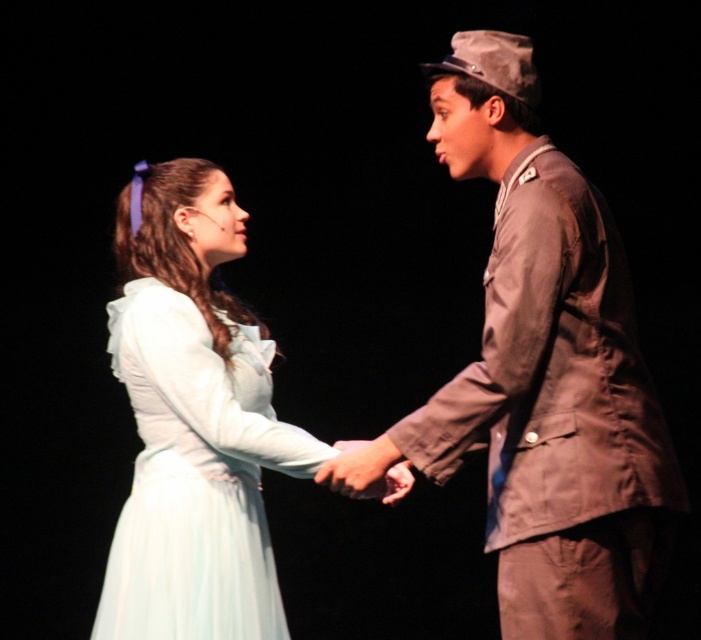
Is matte brown uniform at right positioned before smooth skin hand at center?

Yes.

From the picture: Does matte brown uniform at right have a smaller size compared to smooth skin hand at center?

Actually, matte brown uniform at right might be larger than smooth skin hand at center.

Locate an element on the screen. matte brown uniform at right is located at coordinates (547, 371).

Does light blue satin dress at center appear over smooth skin hand at center?

Yes.

Find the location of a particular element. The height and width of the screenshot is (640, 701). light blue satin dress at center is located at coordinates (196, 476).

Is matte brown uniform at right positioned in front of light blue satin dress at center?

Yes, matte brown uniform at right is in front of light blue satin dress at center.

Can you confirm if matte brown uniform at right is positioned to the right of light blue satin dress at center?

Yes, matte brown uniform at right is to the right of light blue satin dress at center.

You are a GUI agent. You are given a task and a screenshot of the screen. Output one action in this format:
    pyautogui.click(x=<x>, y=<y>)
    Task: Click on the matte brown uniform at right
    This screenshot has width=701, height=640.
    Given the screenshot: What is the action you would take?
    pyautogui.click(x=547, y=371)